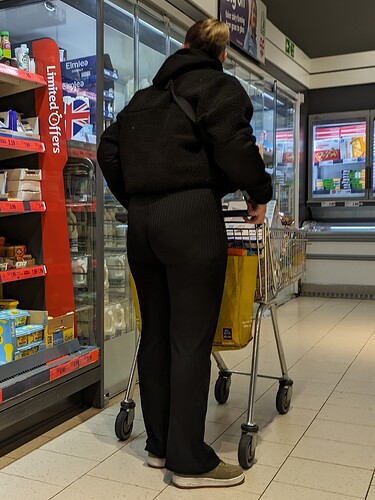
The width and height of the screenshot is (375, 500). Find the location of `3 different tile sizes on flooring`. 3 different tile sizes on flooring is located at coordinates (331, 454), (57, 462), (27, 447).